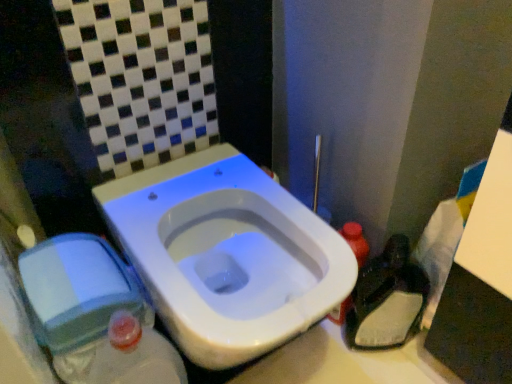
Question: Can you confirm if dark plastic bag at lower right is positioned to the right of translucent plastic bottle at right?

Choices:
 (A) yes
 (B) no

Answer: (A)

Question: Considering the relative sizes of dark plastic bag at lower right and translucent plastic bottle at right in the image provided, is dark plastic bag at lower right thinner than translucent plastic bottle at right?

Choices:
 (A) yes
 (B) no

Answer: (A)

Question: From the image's perspective, would you say dark plastic bag at lower right is positioned over translucent plastic bottle at right?

Choices:
 (A) yes
 (B) no

Answer: (B)

Question: Is dark plastic bag at lower right smaller than translucent plastic bottle at right?

Choices:
 (A) no
 (B) yes

Answer: (A)

Question: Considering the relative positions of dark plastic bag at lower right and translucent plastic bottle at right in the image provided, is dark plastic bag at lower right to the left of translucent plastic bottle at right from the viewer's perspective?

Choices:
 (A) no
 (B) yes

Answer: (A)

Question: Based on their sizes in the image, would you say translucent plastic bottle at right is bigger or smaller than white glossy toilet at center?

Choices:
 (A) big
 (B) small

Answer: (B)

Question: In terms of height, does translucent plastic bottle at right look taller or shorter compared to white glossy toilet at center?

Choices:
 (A) short
 (B) tall

Answer: (A)

Question: Is translucent plastic bottle at right inside or outside of white glossy toilet at center?

Choices:
 (A) outside
 (B) inside

Answer: (A)

Question: In terms of width, does translucent plastic bottle at right look wider or thinner when compared to white glossy toilet at center?

Choices:
 (A) wide
 (B) thin

Answer: (B)

Question: From the image's perspective, is translucent plastic bottle at right above or below dark plastic bag at lower right?

Choices:
 (A) above
 (B) below

Answer: (A)

Question: In terms of width, does translucent plastic bottle at right look wider or thinner when compared to dark plastic bag at lower right?

Choices:
 (A) thin
 (B) wide

Answer: (B)

Question: Is translucent plastic bottle at right taller or shorter than dark plastic bag at lower right?

Choices:
 (A) short
 (B) tall

Answer: (A)

Question: Is translucent plastic bottle at right in front of or behind dark plastic bag at lower right in the image?

Choices:
 (A) front
 (B) behind

Answer: (B)

Question: Is point (389, 327) positioned closer to the camera than point (233, 236)?

Choices:
 (A) farther
 (B) closer

Answer: (B)

Question: From their relative heights in the image, would you say dark plastic bag at lower right is taller or shorter than white glossy toilet at center?

Choices:
 (A) tall
 (B) short

Answer: (B)